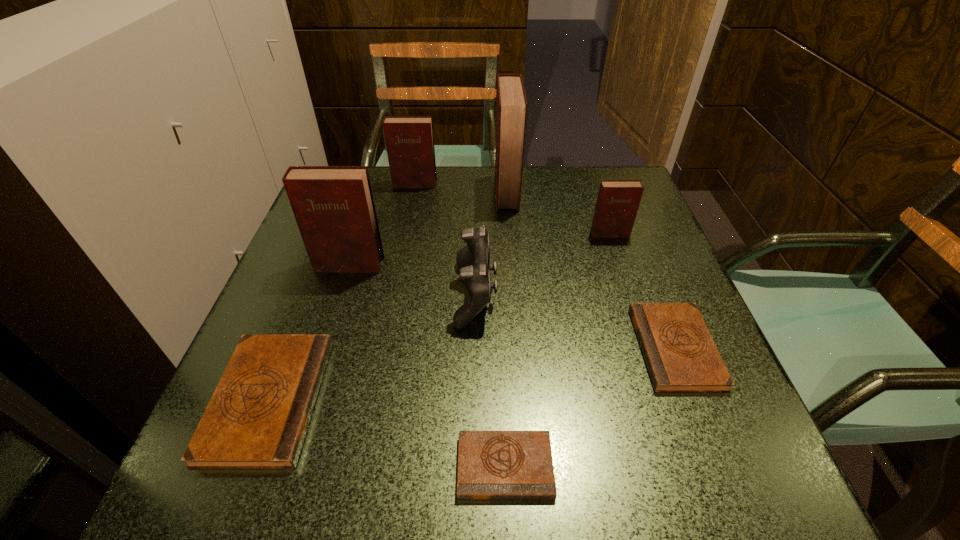
Where is `the biggest reddish-brown diary`? The height and width of the screenshot is (540, 960). the biggest reddish-brown diary is located at coordinates (511, 110).

This screenshot has width=960, height=540. In order to click on the tallest object in this screenshot , I will do [511, 110].

Find the location of `the second tallest diary`. the second tallest diary is located at coordinates (334, 208).

Locate an element on the screen. the seventh shortest object is located at coordinates (334, 208).

Where is `the sixth shortest object`? the sixth shortest object is located at coordinates (409, 140).

Locate an element on the screen. The width and height of the screenshot is (960, 540). the third biggest reddish-brown diary is located at coordinates (409, 140).

Where is `the fourth tallest diary`? the fourth tallest diary is located at coordinates pyautogui.click(x=618, y=201).

This screenshot has height=540, width=960. What are the coordinates of `the smallest reddish-brown diary` in the screenshot? It's located at (618, 201).

Where is `control`? Image resolution: width=960 pixels, height=540 pixels. control is located at coordinates (473, 260).

This screenshot has width=960, height=540. In order to click on the leftmost brown diary in this screenshot , I will do `click(257, 418)`.